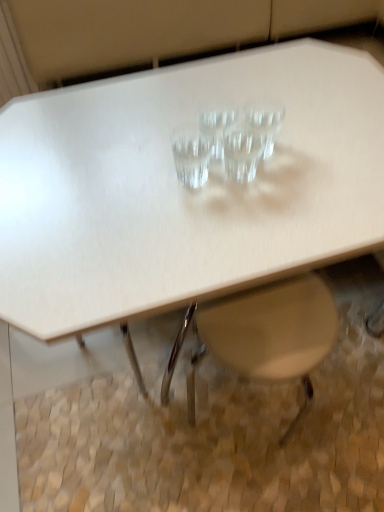
Image resolution: width=384 pixels, height=512 pixels. What are the coordinates of `vacant area located to the right-hand side of transparent glass martini glass at center, which is the second martini glass from left to right` in the screenshot? It's located at (301, 148).